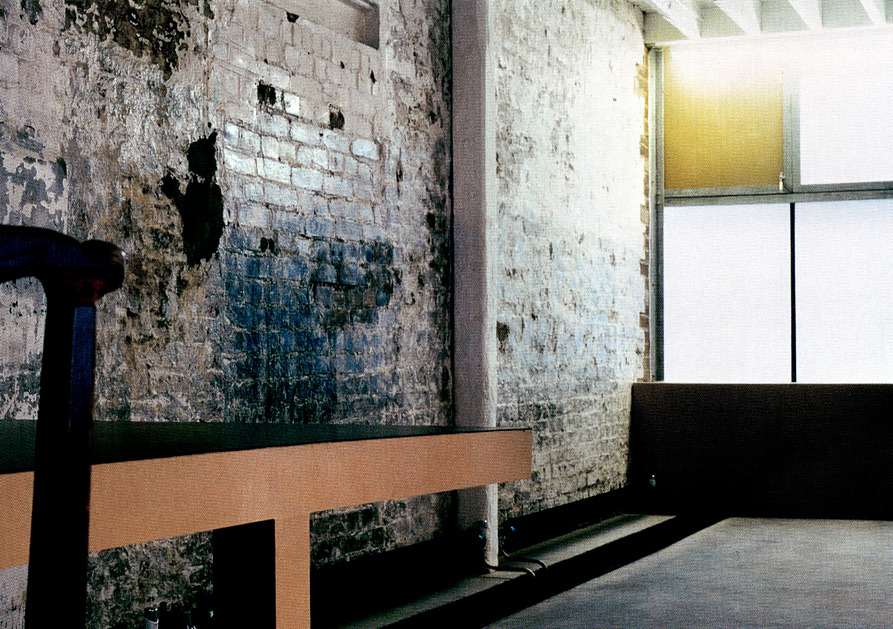
Locate an element on the screen. insulated vertical pipe is located at coordinates (473, 185).